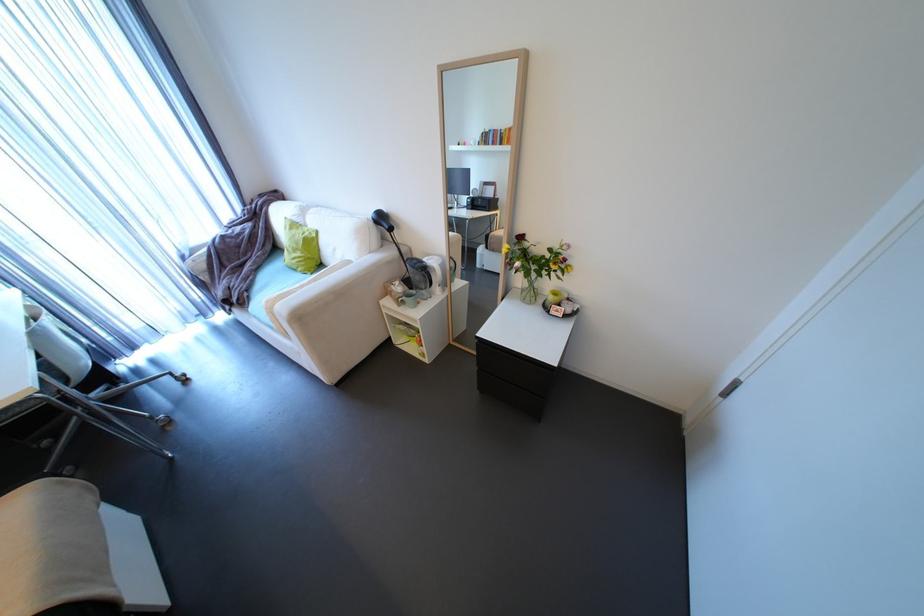
Find the location of `white sofa cushion`. white sofa cushion is located at coordinates (199, 265).